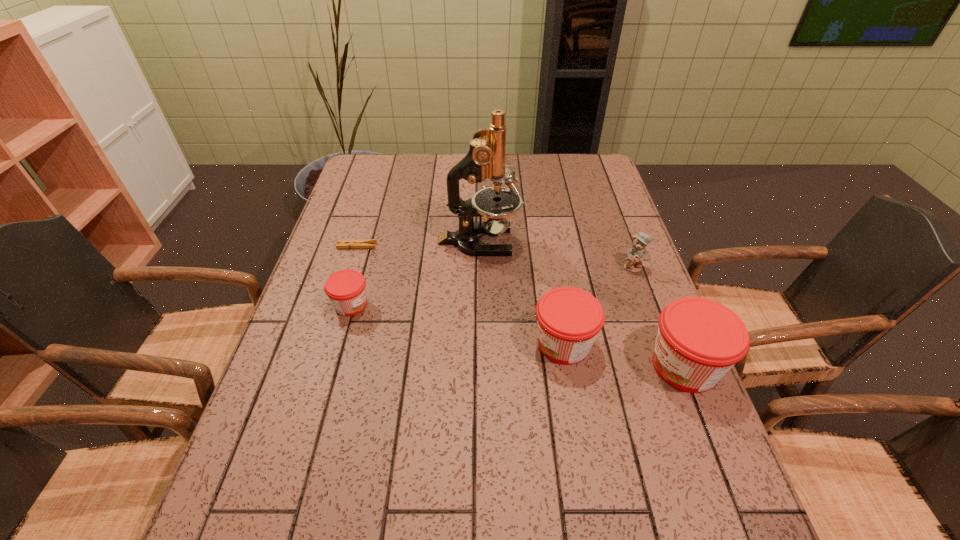
Identify the location of free spot located 0.060m on the label side of the second shortest jam. (506, 344).

The width and height of the screenshot is (960, 540). I want to click on vacant point located on the label side of the second shortest jam, so click(459, 344).

Find the location of `free space located 0.300m on the label side of the second shortest jam`. free space located 0.300m on the label side of the second shortest jam is located at coordinates (404, 344).

Locate an element on the screen. This screenshot has width=960, height=540. free space located on the label side of the rightmost jam is located at coordinates (485, 366).

You are a GUI agent. You are given a task and a screenshot of the screen. Output one action in this format:
    pyautogui.click(x=<x>, y=<y>)
    Task: Click on the free space located 0.090m on the label side of the rightmost jam
    Image resolution: width=960 pixels, height=540 pixels.
    Given the screenshot: What is the action you would take?
    pyautogui.click(x=605, y=366)

The image size is (960, 540). I want to click on vacant space situated 0.280m on the label side of the rightmost jam, so click(x=520, y=366).

I want to click on blank area located on the front-facing side of the fourth nearest object, so click(649, 309).

Locate an element on the screen. The width and height of the screenshot is (960, 540). vacant area situated 0.190m at the eyepiece of the fourth object from right to left is located at coordinates (585, 242).

Image resolution: width=960 pixels, height=540 pixels. In order to click on vacant space located 0.310m on the front of the shortest object in this screenshot , I will do `click(330, 333)`.

I want to click on jam positioned at the left edge, so click(x=346, y=289).